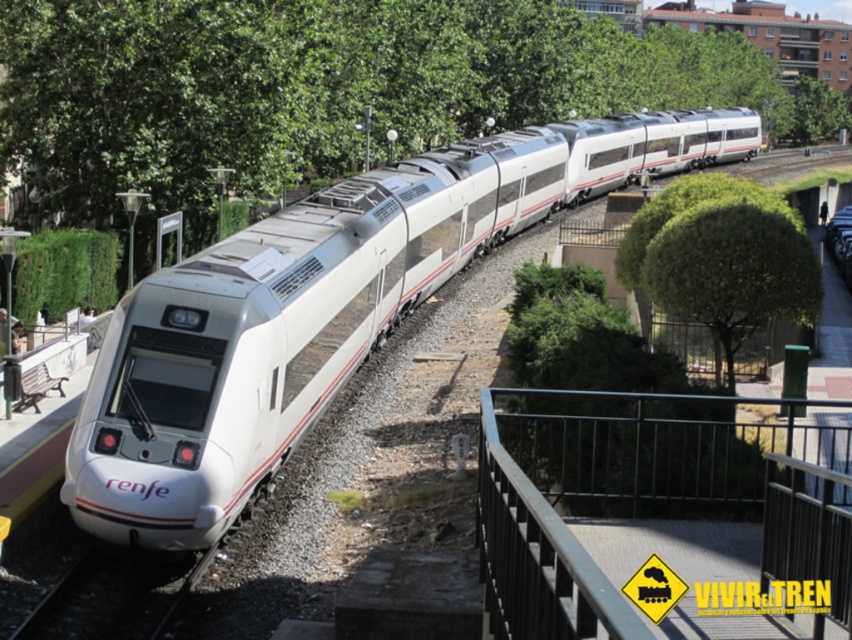
Question: Among these points, which one is nearest to the camera?

Choices:
 (A) (674, 212)
 (B) (182, 429)
 (C) (833, 236)

Answer: (B)

Question: From the image, what is the correct spatial relationship of green leafy tree at center-right in relation to green leafy tree at upper center?

Choices:
 (A) right
 (B) left

Answer: (B)

Question: Is black metal/rail at center to the left of green leafy tree at center-right from the viewer's perspective?

Choices:
 (A) no
 (B) yes

Answer: (B)

Question: Does white glossy bullet train at center appear over black metal/rail at center?

Choices:
 (A) no
 (B) yes

Answer: (B)

Question: Which object is positioned farthest from the black metal train track at lower left?

Choices:
 (A) green leafy tree at center-right
 (B) black metal/rail at center

Answer: (A)

Question: Based on their relative distances, which object is farther from the green leafy tree at upper center?

Choices:
 (A) metallic silver car at center-right
 (B) black metal/rail at center

Answer: (B)